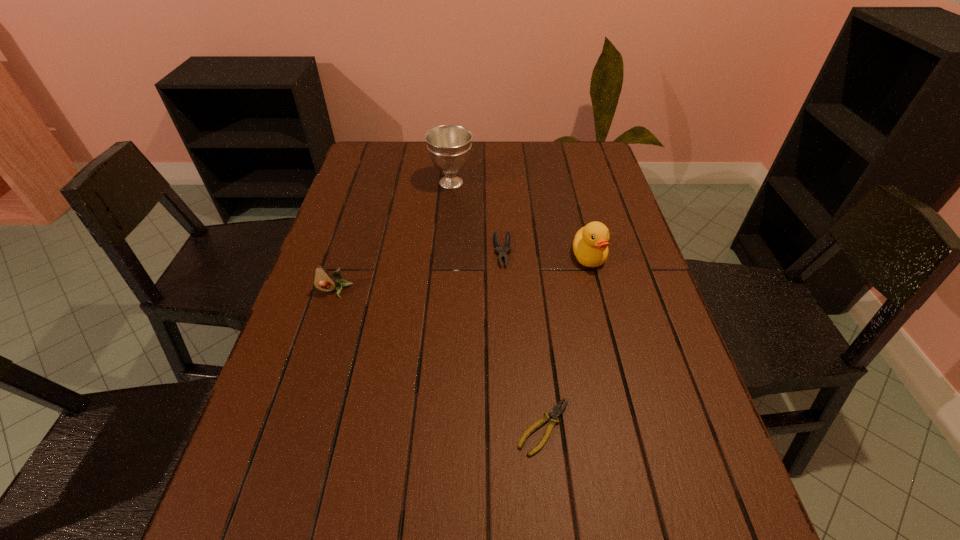
In order to click on the fourth object from right to left in this screenshot , I will do `click(449, 146)`.

Find the location of a particular element. The image size is (960, 540). the tallest object is located at coordinates (449, 146).

The height and width of the screenshot is (540, 960). I want to click on the rightmost object, so click(590, 247).

This screenshot has height=540, width=960. In order to click on the fourth shortest object in this screenshot , I will do `click(590, 247)`.

Identify the location of the third shortest object. The height and width of the screenshot is (540, 960). (323, 280).

Find the location of a particular element. avocado is located at coordinates (323, 280).

Identify the location of the farther pliers. (498, 249).

Where is `the fourth tallest object`? The height and width of the screenshot is (540, 960). the fourth tallest object is located at coordinates (498, 249).

The height and width of the screenshot is (540, 960). I want to click on the nearer pliers, so click(555, 412).

What are the coordinates of `the nearest object` in the screenshot? It's located at (555, 412).